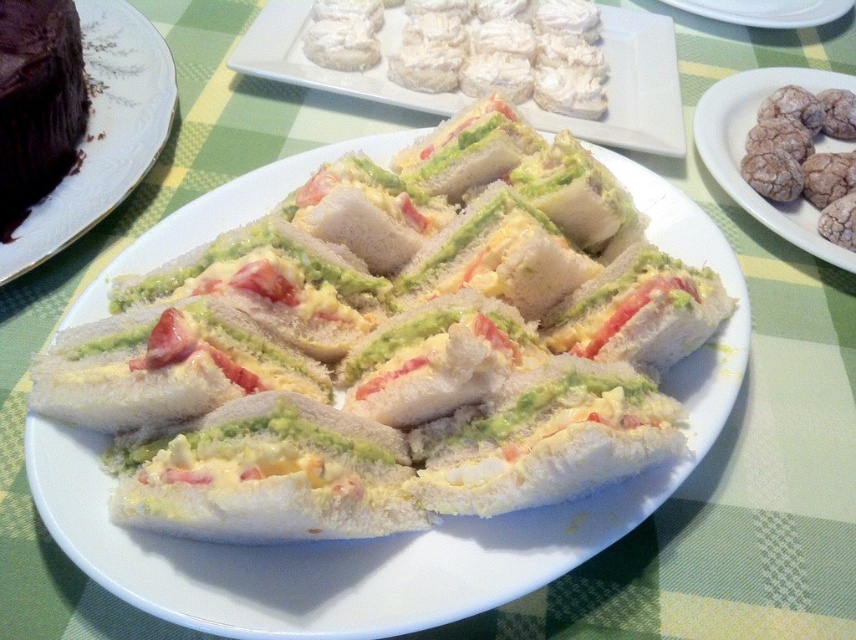
Does white bread sandwiches at center have a greater width compared to white cream cheese sandwiches at center?

Yes.

Does white bread sandwiches at center appear over white cream cheese sandwiches at center?

Incorrect, white bread sandwiches at center is not positioned above white cream cheese sandwiches at center.

I want to click on white bread sandwiches at center, so click(401, 534).

Who is taller, white bread sandwiches at center or chocolate cake at upper left?

Standing taller between the two is white bread sandwiches at center.

Does white bread sandwiches at center appear on the right side of chocolate cake at upper left?

Yes, white bread sandwiches at center is to the right of chocolate cake at upper left.

Identify the location of white bread sandwiches at center. (401, 534).

Consider the image. Which of these two, chocolate cake at upper left or brown crumbly cookies at right, stands shorter?

Standing shorter between the two is brown crumbly cookies at right.

Between chocolate cake at upper left and brown crumbly cookies at right, which one has more height?

chocolate cake at upper left is taller.

Between point (76, 236) and point (714, 157), which one is positioned in front?

Point (76, 236) is in front.

In order to click on chocolate cake at upper left in this screenshot , I will do `click(102, 132)`.